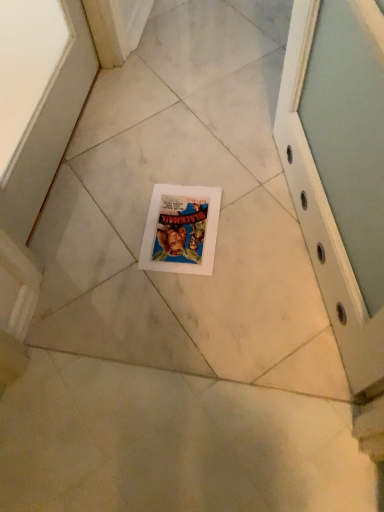
Find the location of a particular element. free region under white paper comic book at center (from a real-world perspective) is located at coordinates (179, 224).